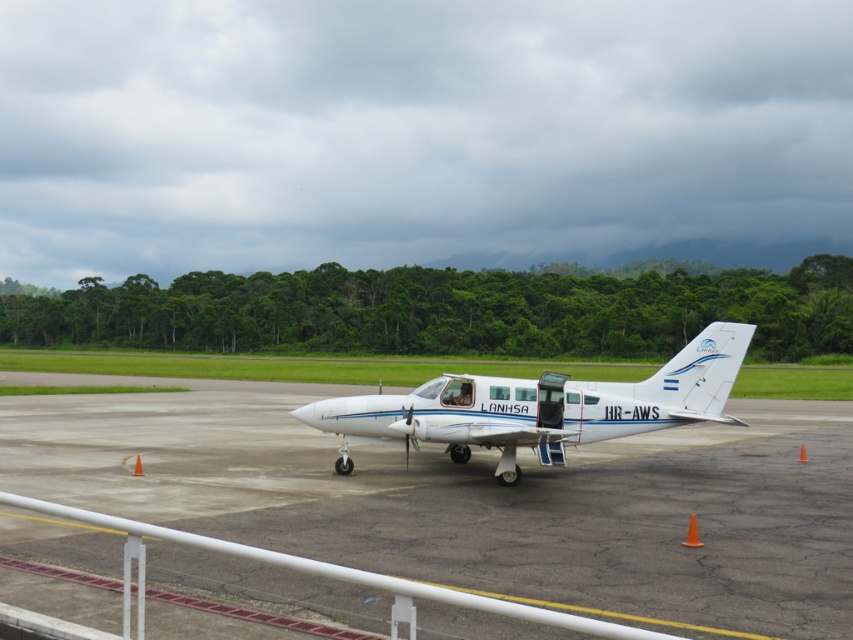
Question: Which of the following is the closest to the observer?

Choices:
 (A) (635, 612)
 (B) (502, 380)

Answer: (A)

Question: Can you confirm if white smooth tarmac at center is bigger than white glossy airplane at center?

Choices:
 (A) no
 (B) yes

Answer: (B)

Question: Is white smooth tarmac at center to the right of white glossy airplane at center from the viewer's perspective?

Choices:
 (A) no
 (B) yes

Answer: (B)

Question: Which of the following is the farthest from the observer?

Choices:
 (A) white smooth tarmac at center
 (B) white glossy airplane at center

Answer: (B)

Question: Can you confirm if white smooth tarmac at center is positioned to the right of white glossy airplane at center?

Choices:
 (A) yes
 (B) no

Answer: (A)